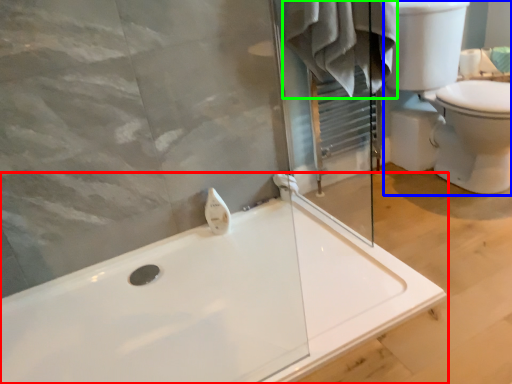
Question: Which object is the closest to the bathtub (highlighted by a red box)? Choose among these: sink (highlighted by a blue box) or bathrobe (highlighted by a green box).

Choices:
 (A) sink
 (B) bathrobe

Answer: (B)